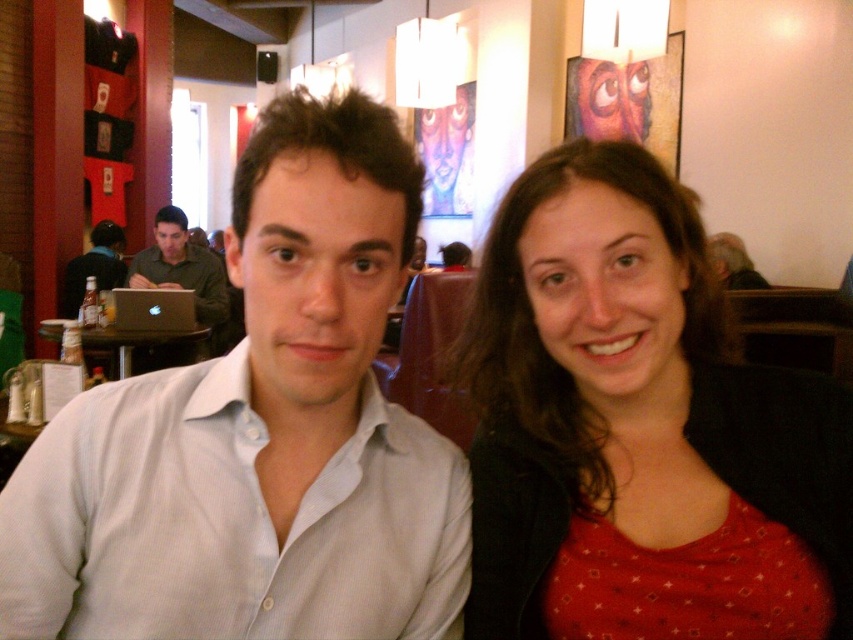
From the picture: Is green matte shirt at left bigger than black plastic table at left?

Indeed, green matte shirt at left has a larger size compared to black plastic table at left.

Can you confirm if green matte shirt at left is positioned above black plastic table at left?

Yes, green matte shirt at left is above black plastic table at left.

Is point (173, 278) positioned behind point (166, 342)?

Yes, point (173, 278) is farther from viewer.

Locate an element on the screen. Image resolution: width=853 pixels, height=640 pixels. green matte shirt at left is located at coordinates (183, 268).

Can you confirm if red matte shirt at center is taller than matte black laptop at left?

Incorrect, red matte shirt at center's height is not larger of matte black laptop at left's.

Where is `red matte shirt at center`? The width and height of the screenshot is (853, 640). red matte shirt at center is located at coordinates (637, 428).

Where is `white shirt at center`? The image size is (853, 640). white shirt at center is located at coordinates (259, 435).

Can you confirm if white shirt at center is positioned above red matte shirt at center?

Yes, white shirt at center is above red matte shirt at center.

Between point (300, 477) and point (486, 412), which one is positioned behind?

Positioned behind is point (486, 412).

What are the coordinates of `white shirt at center` in the screenshot? It's located at (259, 435).